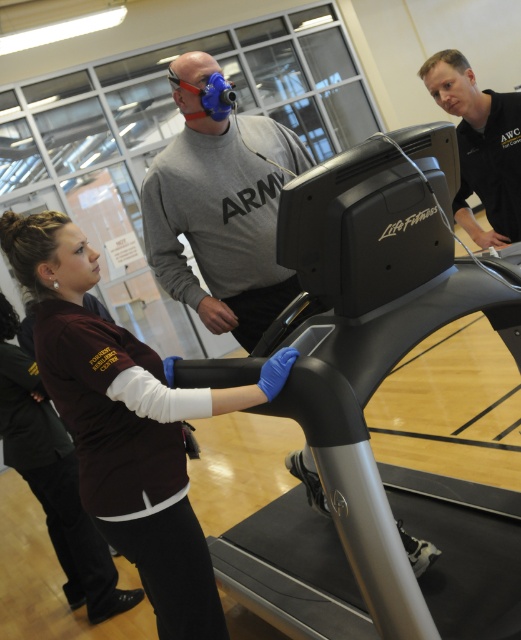
Can you confirm if black plastic treadmill at center is positioned below maroon jersey at center?

Yes.

Does black plastic treadmill at center come behind maroon jersey at center?

No, it is in front of maroon jersey at center.

You are a GUI agent. You are given a task and a screenshot of the screen. Output one action in this format:
    pyautogui.click(x=<x>, y=<y>)
    Task: Click on the black plastic treadmill at center
    
    Given the screenshot: What is the action you would take?
    pyautogui.click(x=365, y=420)

Can you confirm if maroon fabric shirt at center is wider than black matte shirt at upper right?

Yes.

Does maroon fabric shirt at center appear on the left side of black matte shirt at upper right?

Yes, maroon fabric shirt at center is to the left of black matte shirt at upper right.

Is point (177, 557) positioned before point (449, 65)?

Yes, it is.

Identify the location of maroon fabric shirt at center. (125, 422).

Can you confirm if maroon fabric shirt at center is positioned to the right of gray matte sweatshirt at center?

In fact, maroon fabric shirt at center is to the left of gray matte sweatshirt at center.

Does maroon fabric shirt at center have a lesser height compared to gray matte sweatshirt at center?

Incorrect, maroon fabric shirt at center's height does not fall short of gray matte sweatshirt at center's.

This screenshot has height=640, width=521. What do you see at coordinates (125, 422) in the screenshot?
I see `maroon fabric shirt at center` at bounding box center [125, 422].

The width and height of the screenshot is (521, 640). Find the location of `maroon fabric shirt at center`. maroon fabric shirt at center is located at coordinates (125, 422).